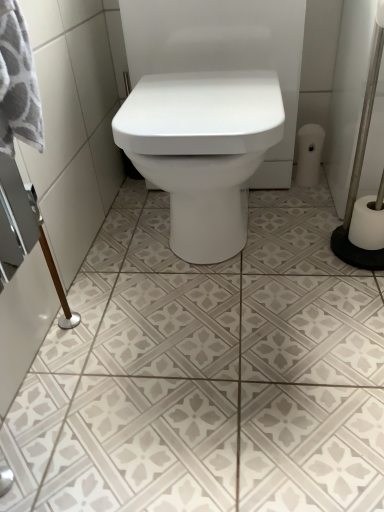
The width and height of the screenshot is (384, 512). I want to click on free space to the back side of white matte toilet paper at right, which is counted as the 2th toilet paper, starting from the left, so click(317, 212).